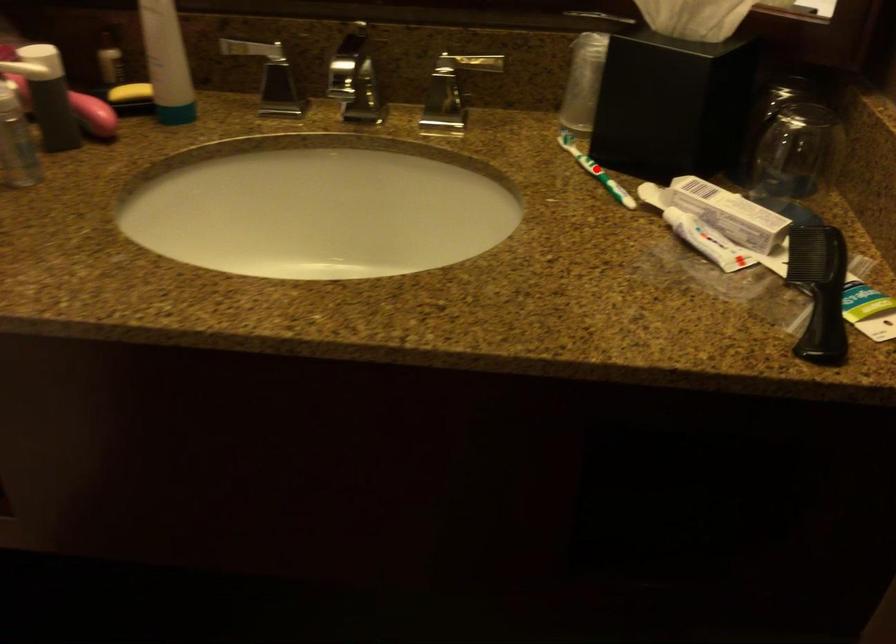
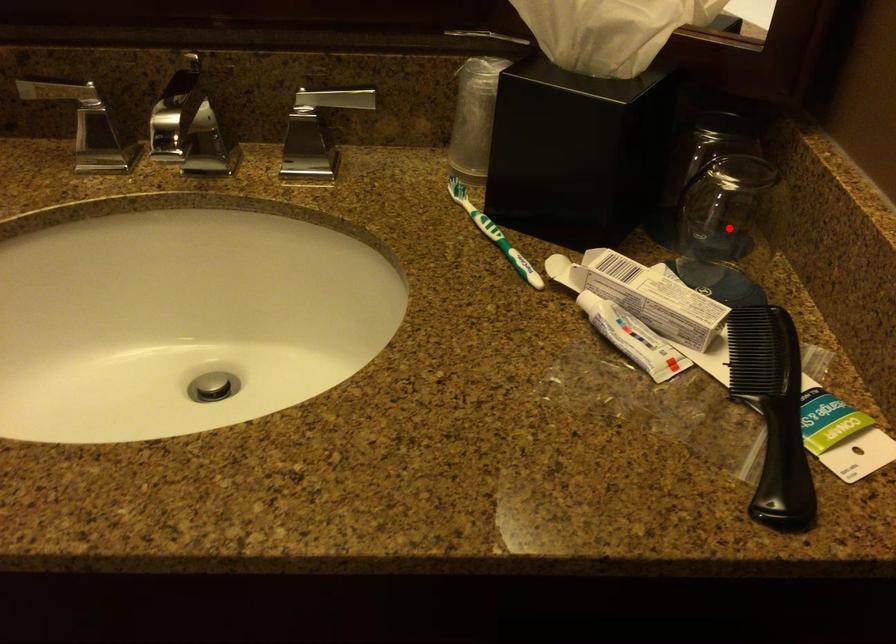
I am providing you with two images of the same scene from different viewpoints. A red point is marked on the first image and another point is marked on the second image. Does the point marked in image1 correspond to the same location as the one in image2?

No